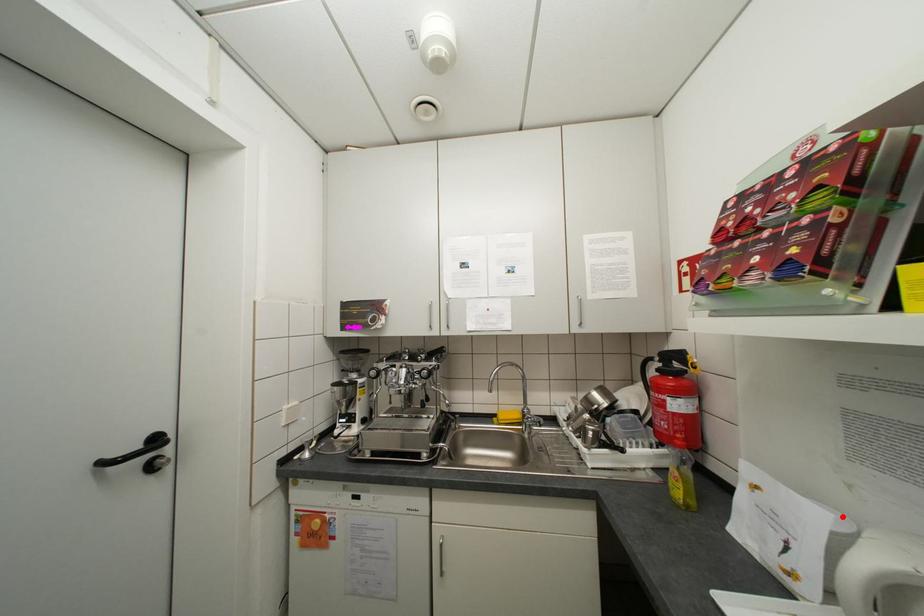
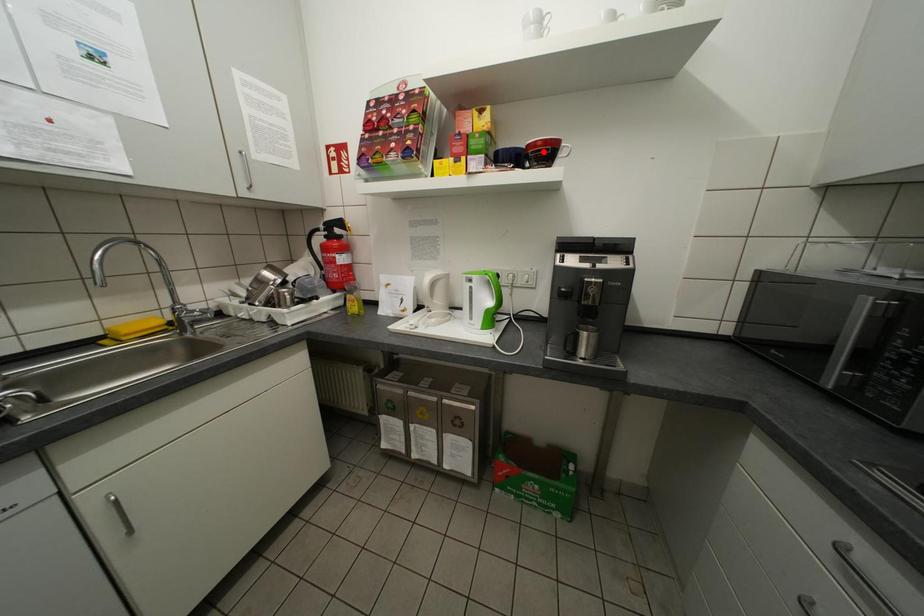
I am providing you with two images of the same scene from different viewpoints. A red point is marked on the first image and another point is marked on the second image. Does the point marked in image1 correspond to the same location as the one in image2?

No